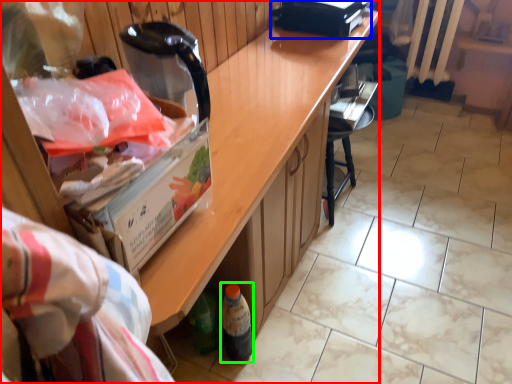
Question: Which object is the farthest from cabinetry (highlighted by a red box)? Choose among these: appliance (highlighted by a blue box) or bottle (highlighted by a green box).

Choices:
 (A) appliance
 (B) bottle

Answer: (A)